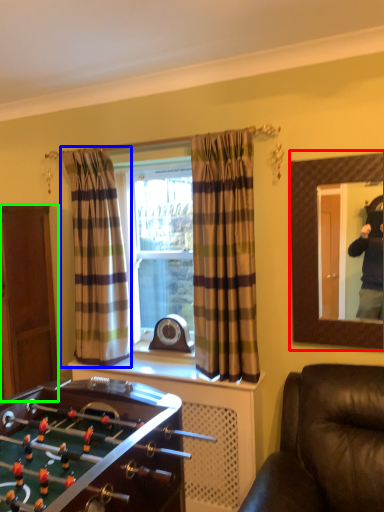
Question: Which object is positioned farthest from mirror (highlighted by a red box)? Select from curtain (highlighted by a blue box) and cabinetry (highlighted by a green box).

Choices:
 (A) curtain
 (B) cabinetry

Answer: (B)